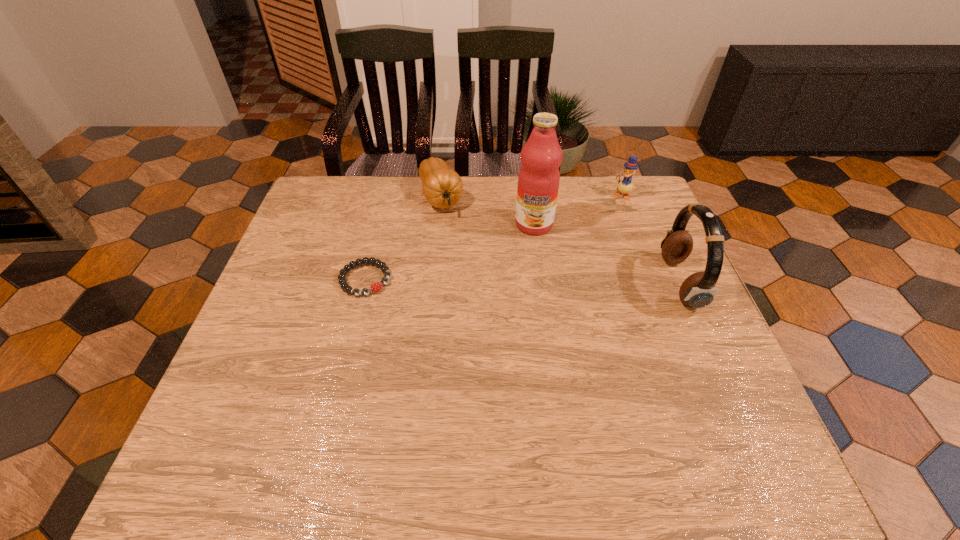
Locate an element on the screen. vacant space that satisfies the following two spatial constraints: 1. on the back side of the fourth object from right to left; 2. on the left side of the duckling is located at coordinates (442, 195).